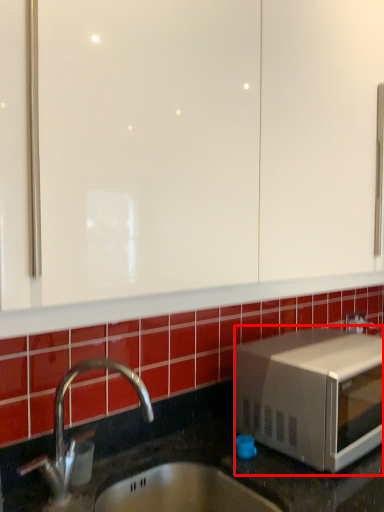
Question: In this image, where is microwave oven (annotated by the red box) located relative to soap dispenser?

Choices:
 (A) right
 (B) left

Answer: (A)